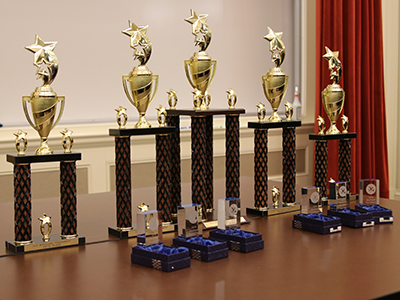
Where is `golden trophies`? The width and height of the screenshot is (400, 300). golden trophies is located at coordinates (44, 113), (135, 84), (205, 70), (274, 87), (334, 98).